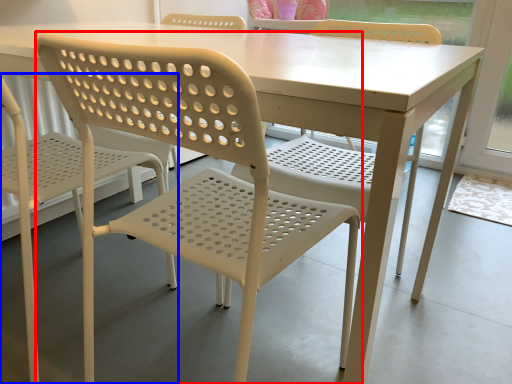
Question: Among these objects, which one is farthest to the camera, chair (highlighted by a red box) or chair (highlighted by a blue box)?

Choices:
 (A) chair
 (B) chair

Answer: (B)